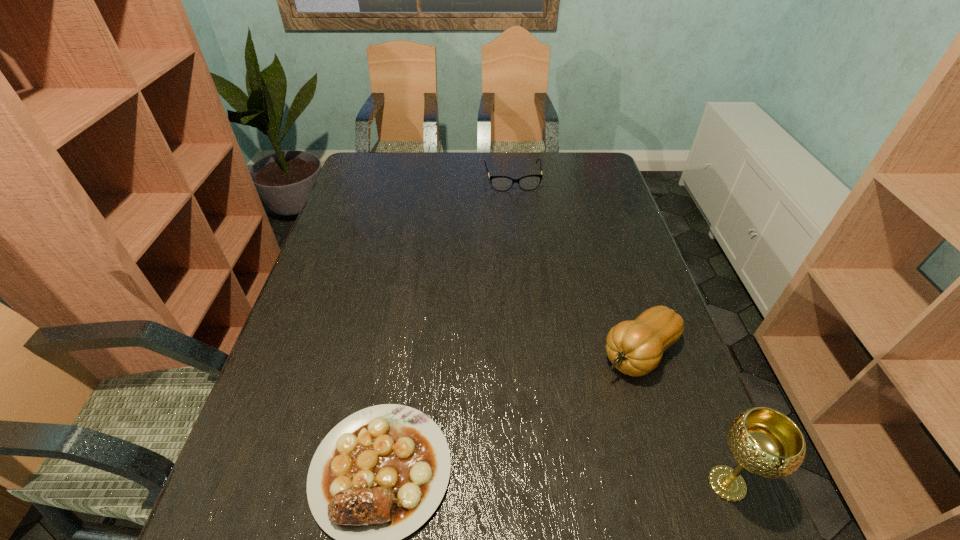
This screenshot has height=540, width=960. I want to click on vacant space located 0.380m on the front-facing side of the spectacles, so click(x=531, y=267).

In order to click on vacant space located 0.230m on the front-facing side of the spectacles in this screenshot , I will do `click(524, 233)`.

Locate an element on the screen. object that is at the far edge is located at coordinates (530, 182).

Locate an element on the screen. This screenshot has width=960, height=540. object at the near edge is located at coordinates pos(767,443).

The height and width of the screenshot is (540, 960). I want to click on chalice that is at the right edge, so click(x=767, y=443).

This screenshot has height=540, width=960. In order to click on gourd situated at the right edge in this screenshot , I will do `click(635, 347)`.

Identify the location of object situated at the near right corner. (767, 443).

Locate an element on the screen. vacant space at the far edge is located at coordinates (485, 158).

Locate an element on the screen. This screenshot has height=540, width=960. vacant area at the left edge is located at coordinates (356, 192).

At what (x,y) coordinates should I click in order to perform the action: click on vacant space at the right edge of the desktop. Please return your answer as a coordinate pair (x, y). The width and height of the screenshot is (960, 540). Looking at the image, I should click on (574, 193).